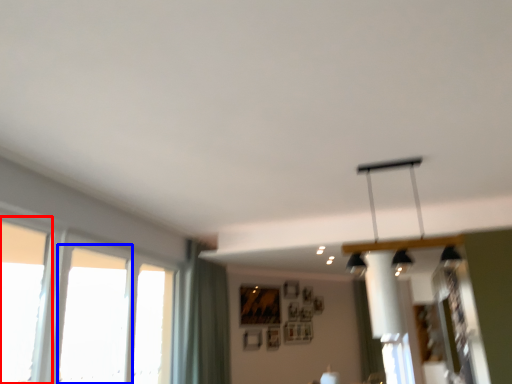
Question: Which object is closer to the camera taking this photo, window (highlighted by a red box) or window (highlighted by a blue box)?

Choices:
 (A) window
 (B) window

Answer: (A)